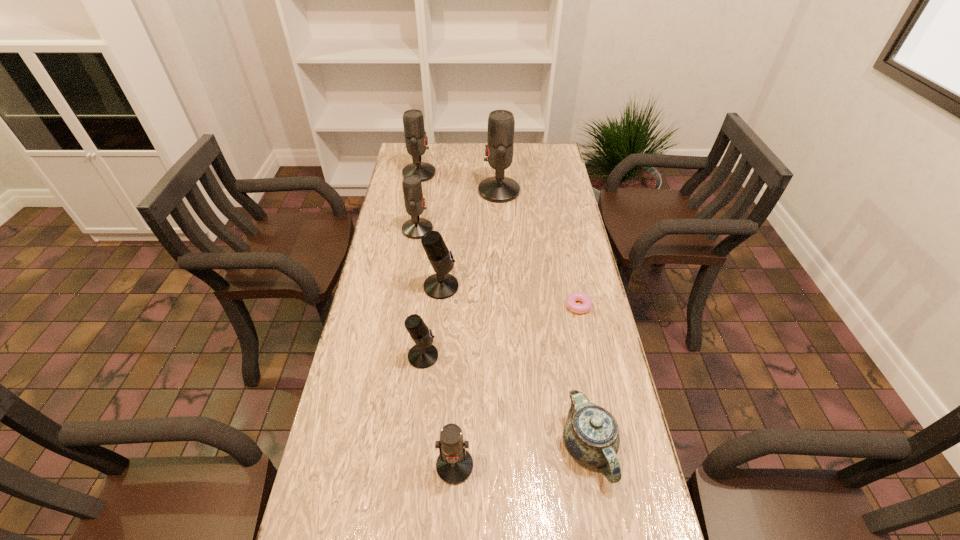
I want to click on free space between the smaller black microphone and the purple doughnut, so click(499, 331).

Identify the location of free space between the second tallest object and the smaller black microphone. (421, 265).

This screenshot has height=540, width=960. In order to click on object that is the closest to the third farthest object in this screenshot , I will do `click(441, 285)`.

The height and width of the screenshot is (540, 960). What are the coordinates of `object that is the second closest one to the second shortest object` in the screenshot? It's located at (571, 300).

Choose which microphone is the fifth nearest neighbor to the seventh shortest object. Please provide its 2D coordinates. Your answer should be formatted as a tuple, i.e. [(x, y)], where the tuple contains the x and y coordinates of a point satisfying the conditions above.

[(454, 465)]

At what (x,y) coordinates should I click in order to perform the action: click on microphone identified as the closest to the doughnut. Please return your answer as a coordinate pair (x, y). The image size is (960, 540). Looking at the image, I should click on (441, 285).

Locate an element on the screen. Image resolution: width=960 pixels, height=540 pixels. red microphone identified as the second closest to the second biggest red microphone is located at coordinates (416, 227).

Where is `red microphone that is the third closest one to the rightmost red microphone`? red microphone that is the third closest one to the rightmost red microphone is located at coordinates click(454, 465).

What are the coordinates of `blank space that satisfies the following two spatial constraints: 1. on the back side of the purple doughnut; 2. on the side of the seventh shortest object with the red ring` in the screenshot? It's located at (548, 173).

Where is `free space that satisfies the following two spatial constraints: 1. on the side of the shortest object with the red ring; 2. on the left side of the sixth nearest object`? This screenshot has height=540, width=960. free space that satisfies the following two spatial constraints: 1. on the side of the shortest object with the red ring; 2. on the left side of the sixth nearest object is located at coordinates (405, 306).